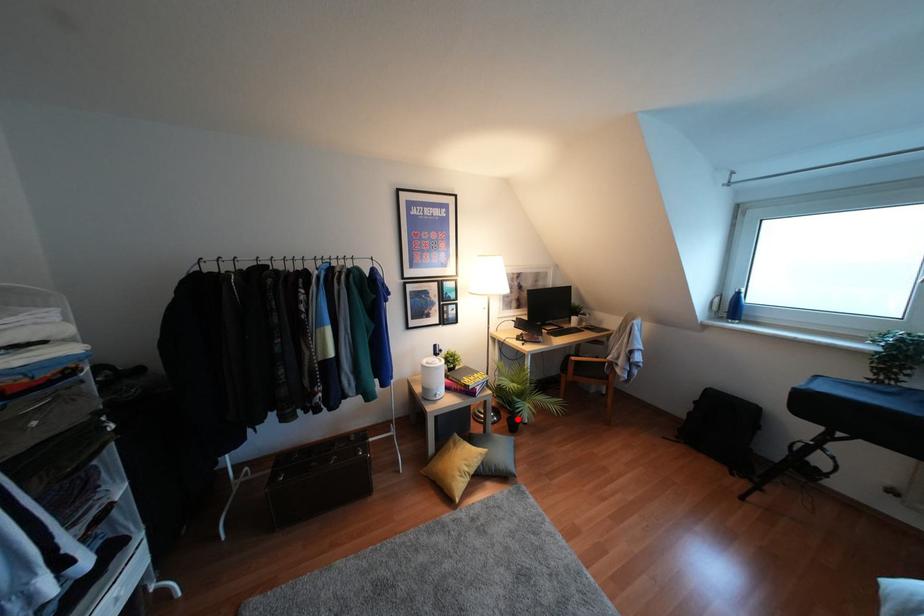
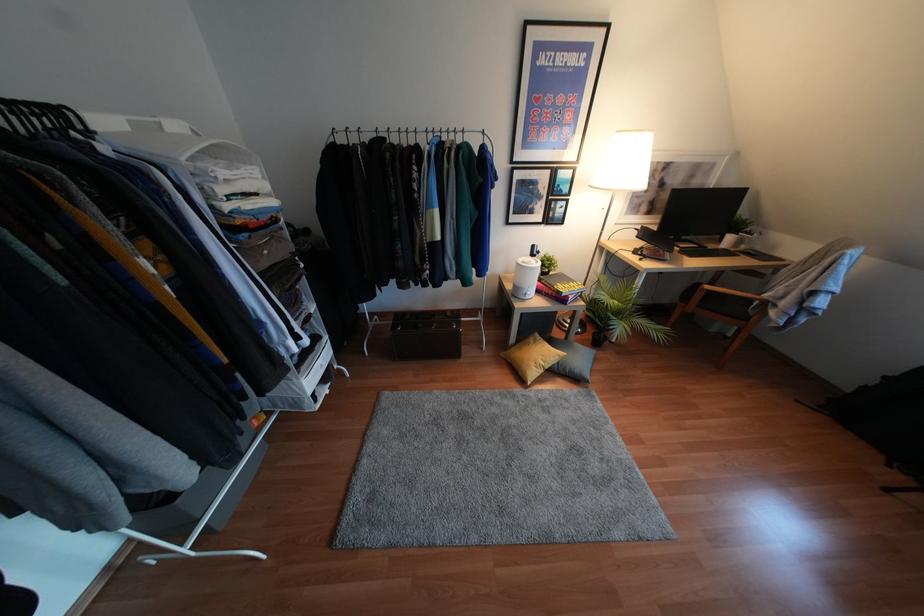
Locate, in the second image, the point that corresponds to the highlighted location in the first image.

(604, 336)